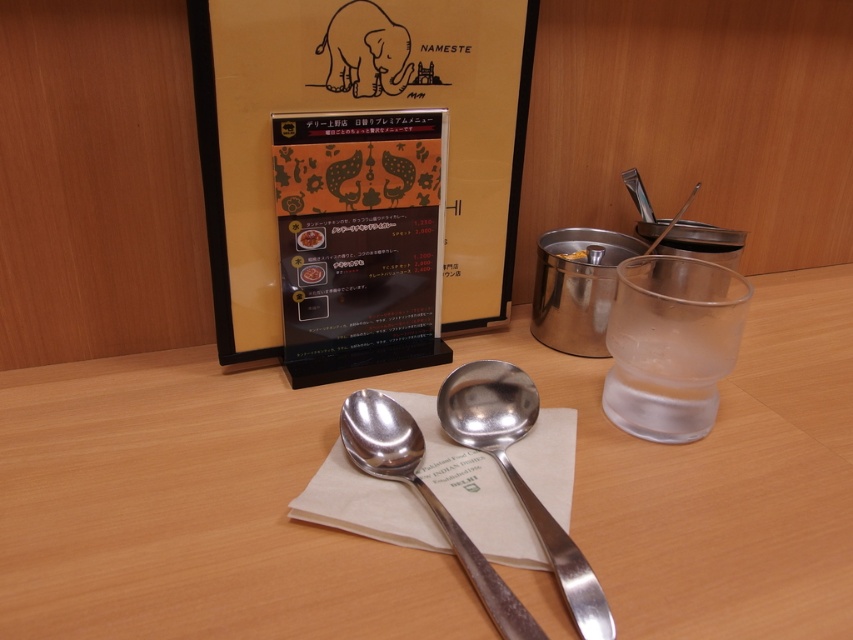
Is point (252, 8) positioned behind point (299, 145)?

No, it is not.

Looking at this image, can you confirm if matte orange menu at upper center is shorter than black plastic menu at center?

Incorrect, matte orange menu at upper center's height does not fall short of black plastic menu at center's.

Image resolution: width=853 pixels, height=640 pixels. Find the location of `matte orange menu at upper center`. matte orange menu at upper center is located at coordinates (355, 109).

Locate an element on the screen. The image size is (853, 640). matte orange menu at upper center is located at coordinates (355, 109).

Between point (219, 397) and point (397, 132), which one is positioned in front?

Point (397, 132)

Who is more distant from viewer, (769,444) or (404,268)?

The point (404,268) is behind.

Who is more forward, (x=33, y=497) or (x=395, y=253)?

Point (x=33, y=497) is more forward.

Locate an element on the screen. This screenshot has height=640, width=853. satin silver spoons at center is located at coordinates (410, 548).

Is point (496, 362) behind point (473, 563)?

Yes, point (496, 362) is behind point (473, 563).

From the picture: Is polished silver spoon at center shorter than silver metallic spoon at center?

In fact, polished silver spoon at center may be taller than silver metallic spoon at center.

Does point (519, 499) lie behind point (440, 522)?

Yes, point (519, 499) is farther from viewer.

Identify the location of polished silver spoon at center. (518, 474).